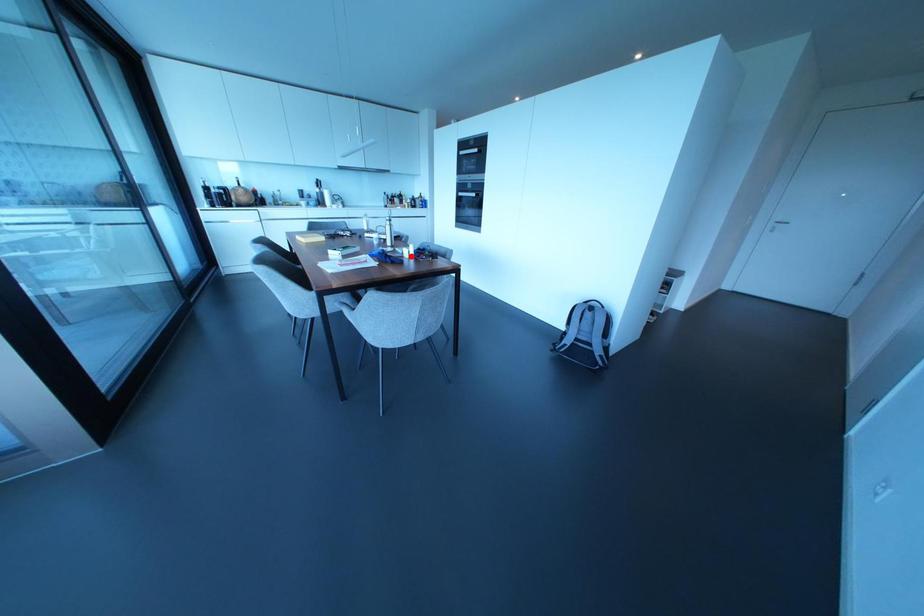
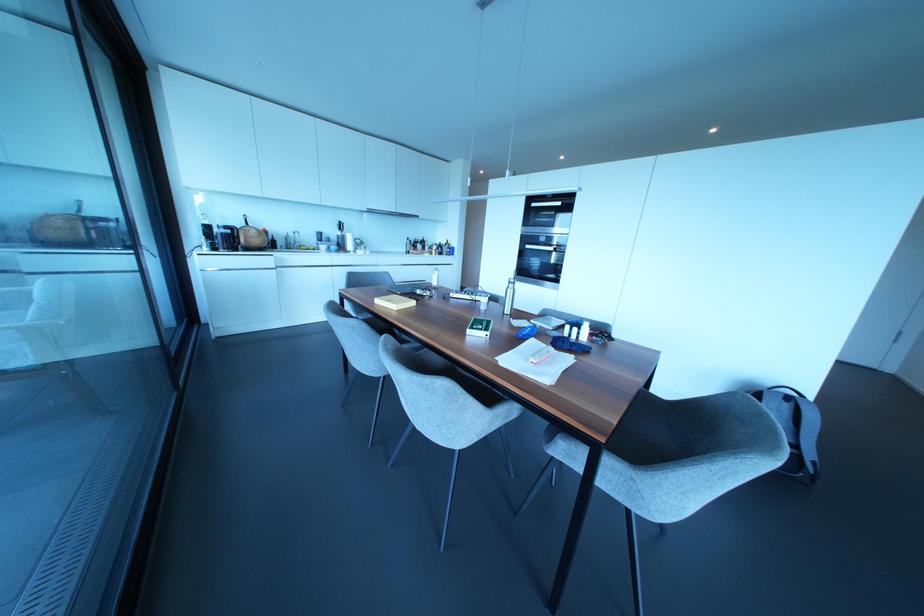
Locate, in the second image, the point that corresponds to the highlighted location in the first image.

(584, 338)